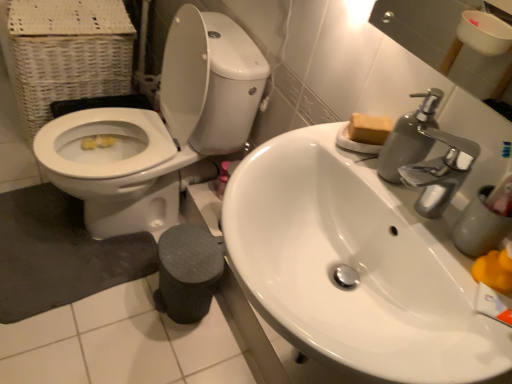
The height and width of the screenshot is (384, 512). What are the coordinates of `free region on the left part of yellow plastic toy at sink right` in the screenshot? It's located at (412, 213).